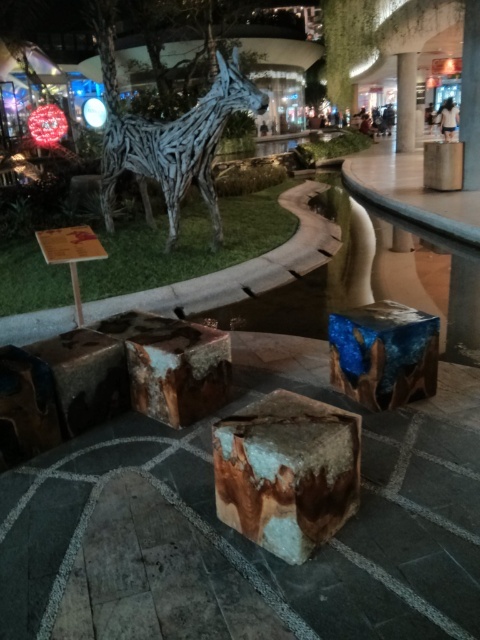
You are standing at the entrance of a garden and see both the rustic wood stump at center and the wooden sculpture at center. Which object is positioned to the right when facing the garden from the entrance?

The rustic wood stump at center is to the right of the wooden sculpture at center, so the rustic wood stump at center is positioned to the right when facing the garden from the entrance.

You are an architect designing a new garden path. You need to place a bench between the rustic wood stump at center and the wooden sculpture at center. The bench is 4 feet long. Is there enough space between them to place the bench without moving either object?

The rustic wood stump at center and wooden sculpture at center are 13.11 feet apart from each other. Since the bench is only 4 feet long, there is more than enough space to place it between them without moving either object.